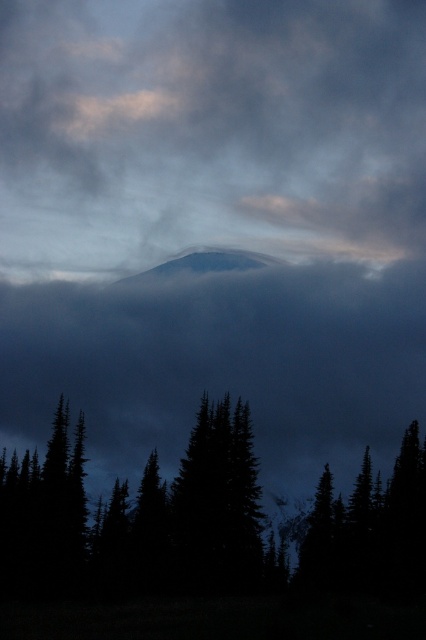
You are an artist trying to paint this scene. You want to ensure the dark green textured tree at center is fully visible. Given that the translucent fog at center partially obscures it, which object should you paint first to achieve this effect?

You should paint the dark green textured tree at center first because the translucent fog at center is larger in size and would cover it if painted later.

You are an observer standing in the forest looking at the mountain. You notice the translucent fog at center and the dark green textured tree at center. Which object is higher in the scene?

The translucent fog at center is taller than the dark green textured tree at center.